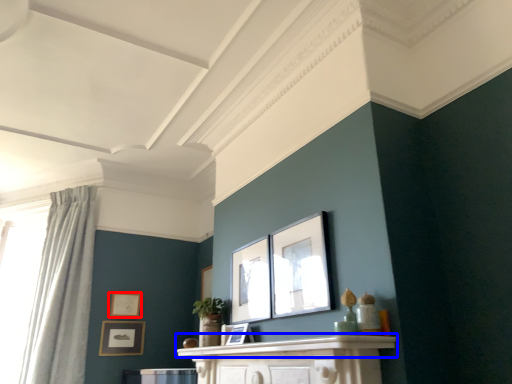
Question: Among these objects, which one is farthest to the camera, picture frame (highlighted by a red box) or mantle (highlighted by a blue box)?

Choices:
 (A) picture frame
 (B) mantle

Answer: (A)